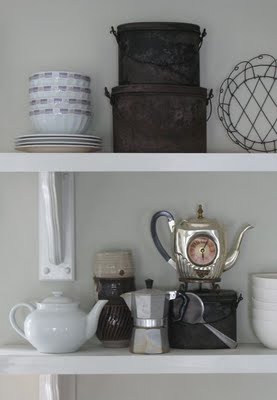
Find the location of a particular element. Image resolution: width=277 pixels, height=400 pixels. knob on top of teapot lid is located at coordinates (57, 293), (147, 283), (200, 211).